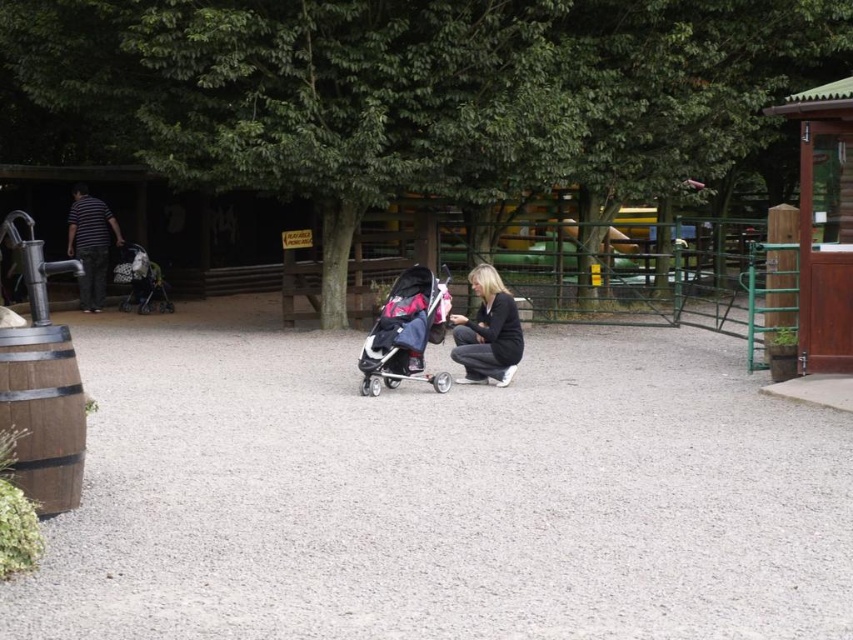
You are standing at the entrance of the park and want to walk to the wooden barrel with a metal band around its middle on the left side of the frame. According to the image, where should you step to avoid the gray gravel at center?

You should step on the area not covered by the gray gravel at center, as the gray gravel at center is located at point [442,497] which is in the center of the image. Avoid stepping there to reach the wooden barrel.

From the picture: You are standing at the point with coordinates point [635,493] and want to walk towards the point [416,324]. Will you pass through any objects along the way?

Since point [635,493] is in front of point [416,324], you are already closer to the destination. Therefore, walking towards point [416,324] from your current position would not require passing through any objects as there is a clear path between them.